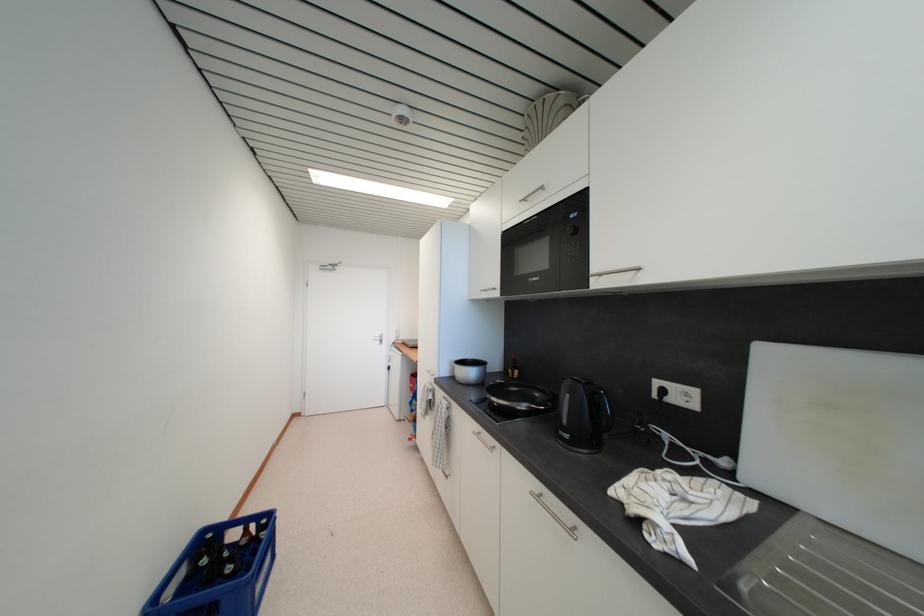
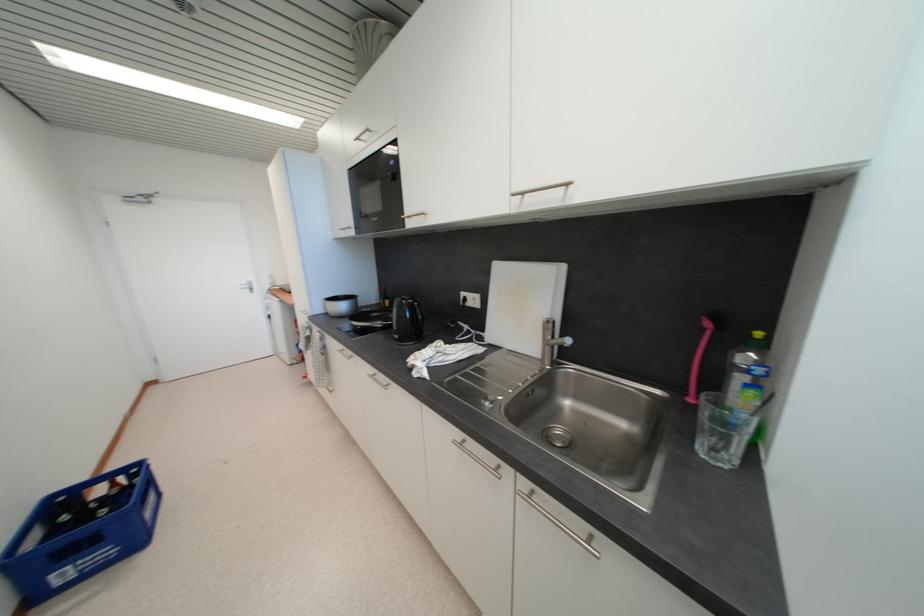
In the second image, find the point that corresponds to point (482, 430) in the first image.

(346, 349)